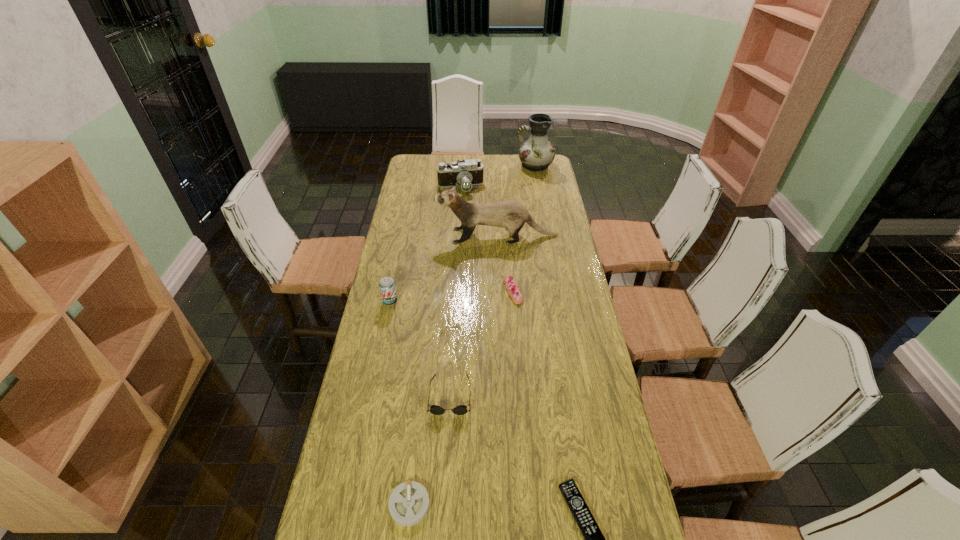
Find the location of a particular element. The image size is (960, 540). beer can positioned at the left edge is located at coordinates (387, 287).

Where is `ashtray that is at the left edge`? This screenshot has height=540, width=960. ashtray that is at the left edge is located at coordinates (408, 504).

Where is `vase that is positioned at the right edge`? The height and width of the screenshot is (540, 960). vase that is positioned at the right edge is located at coordinates (537, 153).

Image resolution: width=960 pixels, height=540 pixels. In order to click on ferret that is at the right edge in this screenshot , I will do `click(510, 214)`.

Find the location of a particular element. Image resolution: width=960 pixels, height=540 pixels. object present at the far right corner is located at coordinates (537, 153).

This screenshot has width=960, height=540. Find the location of `vacant space at the far edge of the desktop`. vacant space at the far edge of the desktop is located at coordinates (498, 172).

Locate an element on the screen. This screenshot has height=540, width=960. vacant space at the left edge of the desktop is located at coordinates (414, 211).

Locate an element on the screen. The width and height of the screenshot is (960, 540). free region at the right edge is located at coordinates (601, 429).

Where is `blank space at the far left corner of the desktop`? blank space at the far left corner of the desktop is located at coordinates (433, 157).

Where is `free space between the second shortest object and the seventh shortest object`? Image resolution: width=960 pixels, height=540 pixels. free space between the second shortest object and the seventh shortest object is located at coordinates (453, 370).